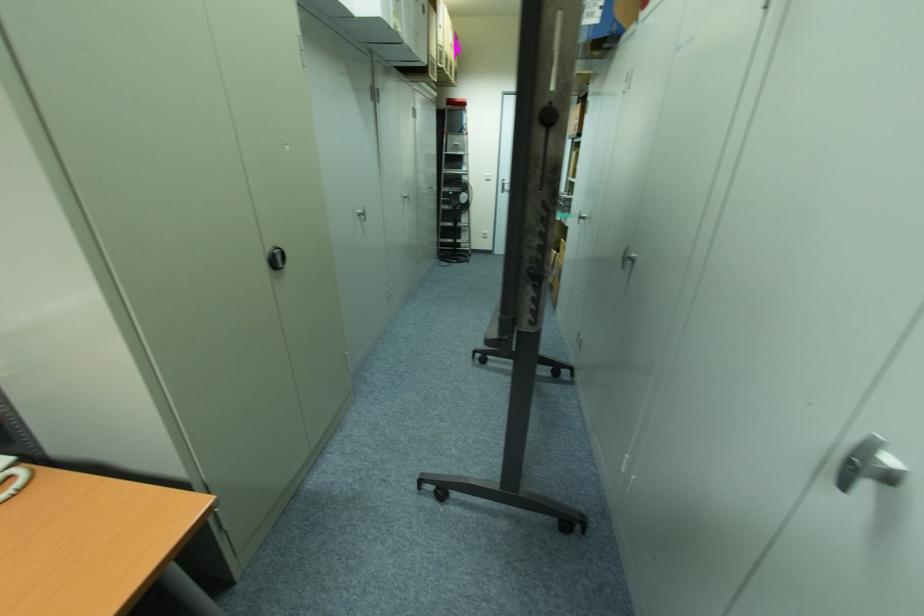
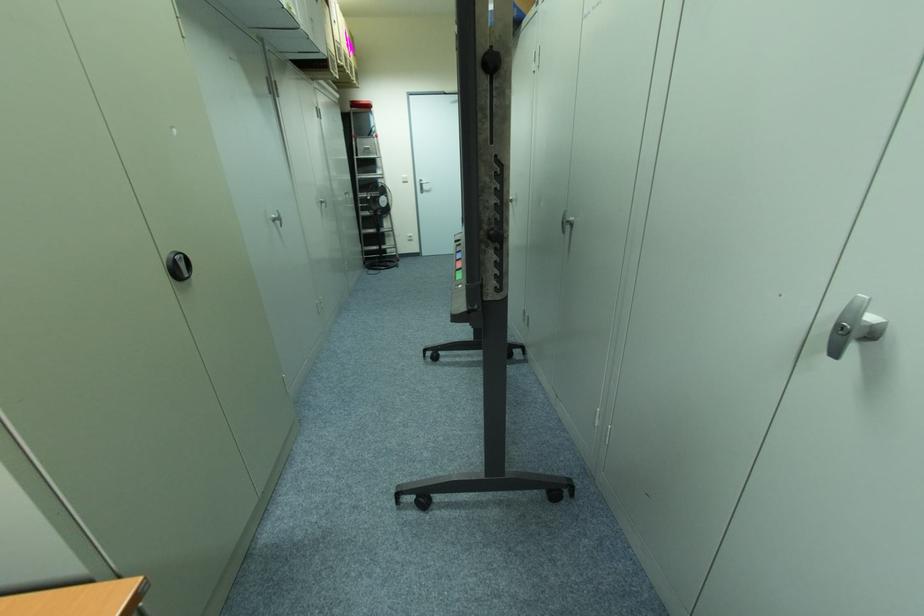
Which direction would the cameraman need to move to produce the second image?

The cameraman moved toward left, forward.